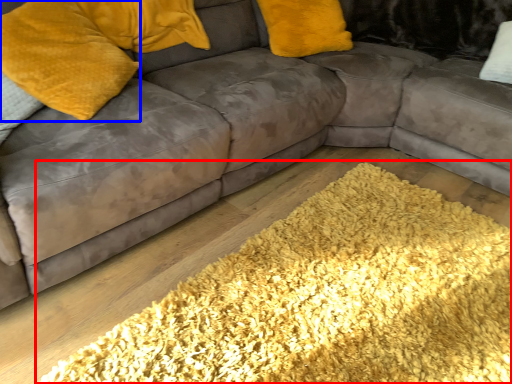
Question: Which object is further to the camera taking this photo, mat (highlighted by a red box) or pillow (highlighted by a blue box)?

Choices:
 (A) mat
 (B) pillow

Answer: (B)